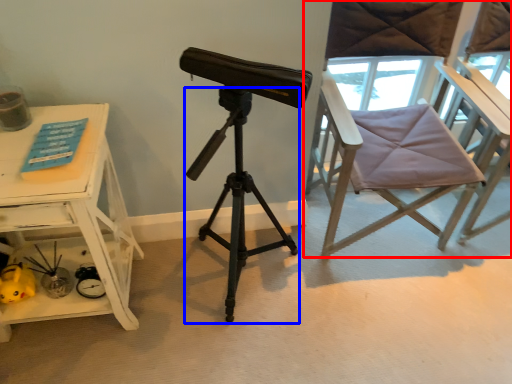
Question: Which of the following is the closest to the observer, chair (highlighted by a red box) or tripod (highlighted by a blue box)?

Choices:
 (A) chair
 (B) tripod

Answer: (B)